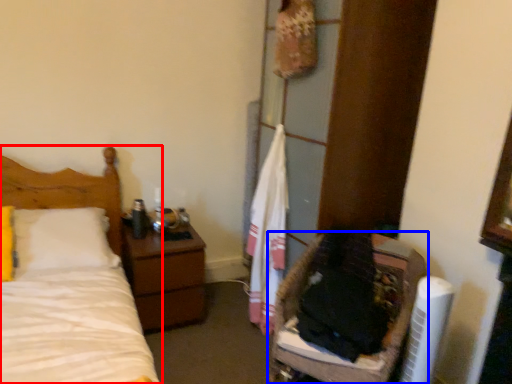
Question: Which object appears closest to the camera in this image, bed (highlighted by a red box) or furniture (highlighted by a blue box)?

Choices:
 (A) bed
 (B) furniture

Answer: (B)